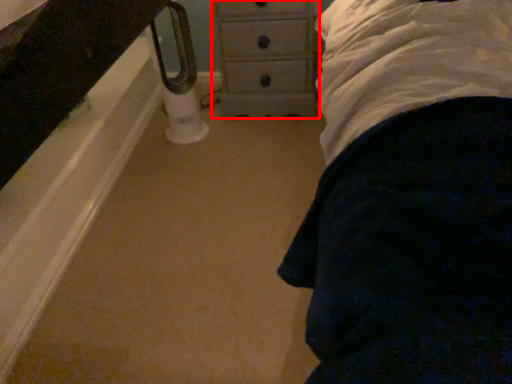
Question: From the image's perspective, where is chest of drawers (annotated by the red box) located in relation to towel bar in the image?

Choices:
 (A) above
 (B) below

Answer: (A)